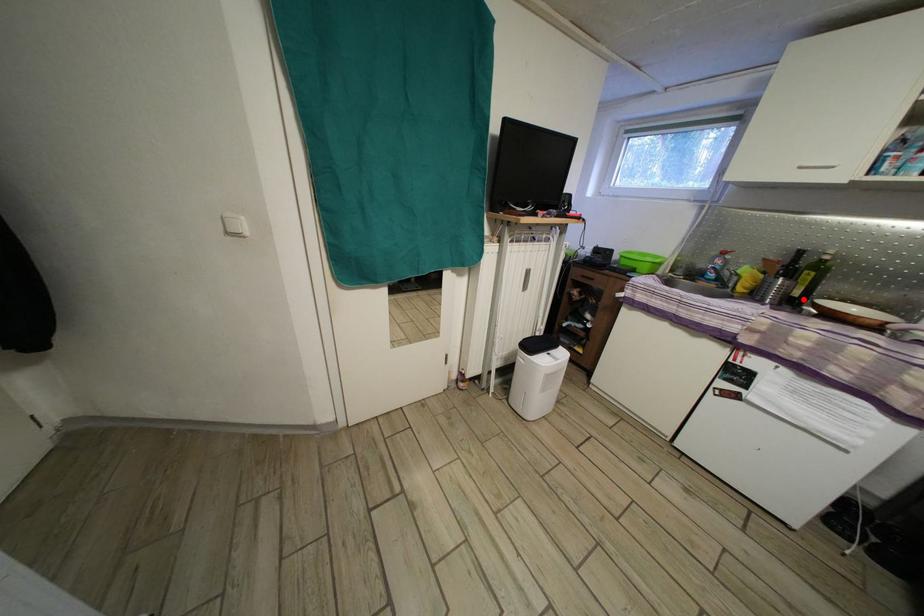
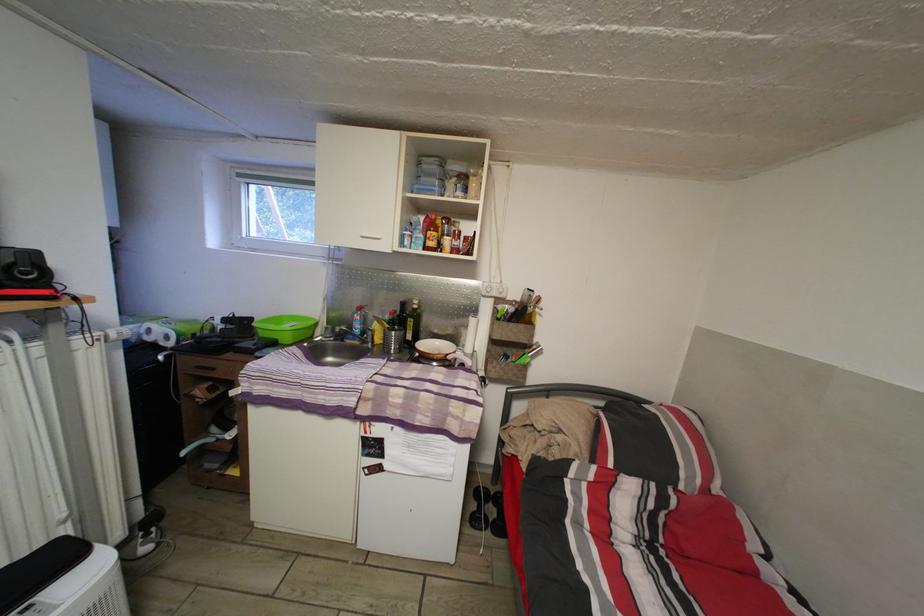
Find the pixel in the second image that matches the highlighted location in the first image.

(417, 344)